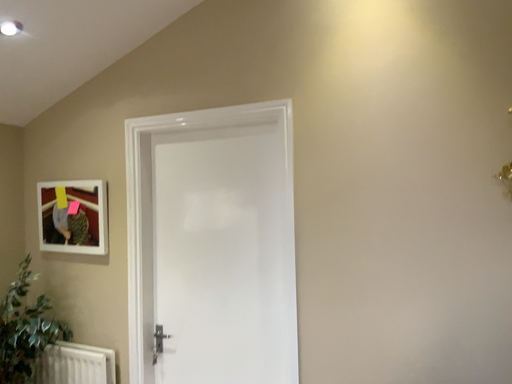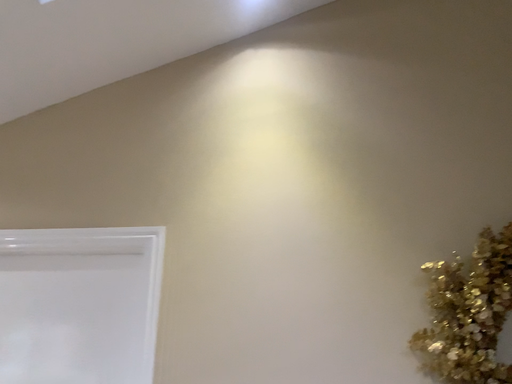
Question: How did the camera likely rotate when shooting the video?

Choices:
 (A) rotated downward
 (B) rotated upward

Answer: (B)